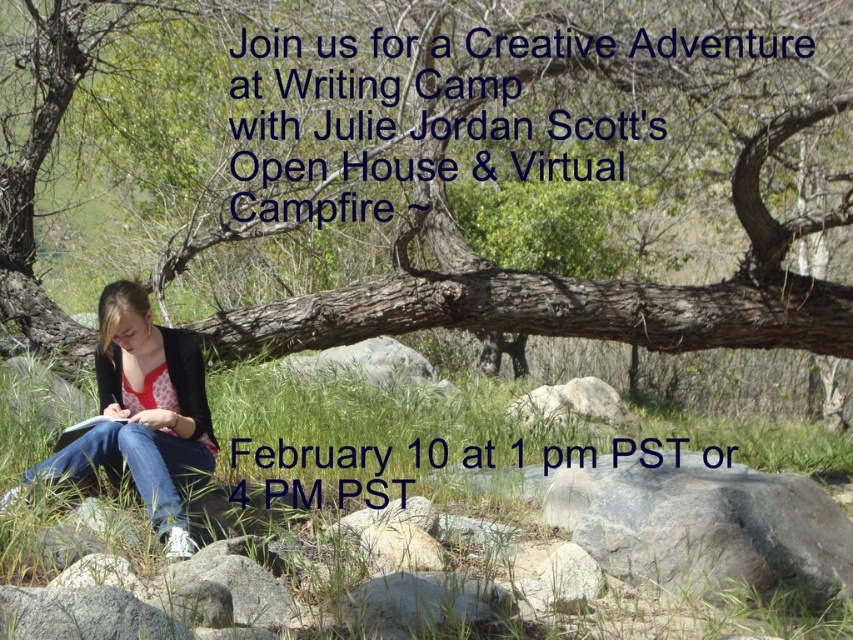
You are a hiker who wants to sit down to rest. You see the green grass at lower center and the gray rough rock at lower right. Which surface would be taller if you were to measure their heights?

The green grass at lower center has a greater height compared to the gray rough rock at lower right, so the green grass at lower center is taller.

You are a hiker who wants to take a photo of the gray rough rock at lower right and the brown rough tree trunk at center. Which object should you position closer to the camera to ensure both are in the frame?

To capture both the gray rough rock at lower right and the brown rough tree trunk at center in the frame, position the gray rough rock at lower right closer to the camera since the brown rough tree trunk at center is to the left of it, making it farther away from the camera.